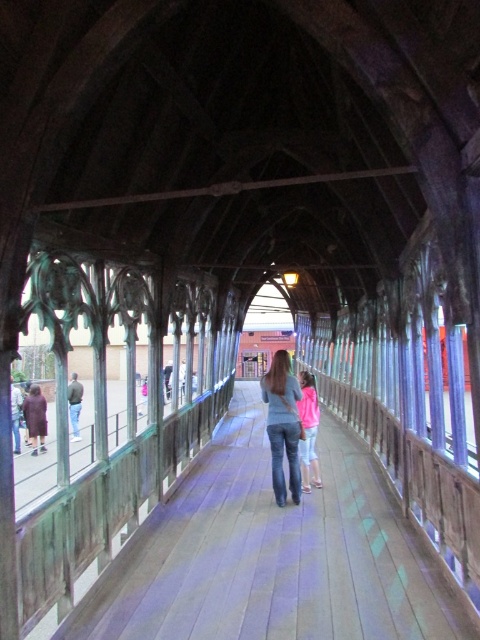
You are a delivery person carrying a large pink fleece jacket at center. You need to walk through the wooden walkway at center. Can you pass through it without bending sideways?

The wooden walkway at center is narrower than the pink fleece jacket at center, so you cannot pass through it without bending sideways.

You are standing at the entrance of the walkway and want to reach the wooden walkway at center. Which direction should you move to get there?

The wooden walkway at center is located at point 0.867 on the x axis and 0.565 on the y axis. Since you are at the entrance, you should move forward along the walkway towards the center point.

You are a person wearing the denim jeans at center and want to walk on the wooden walkway at center. Can you fit comfortably on the walkway?

The wooden walkway at center is narrower than the denim jeans at center, so it might be difficult to walk comfortably.